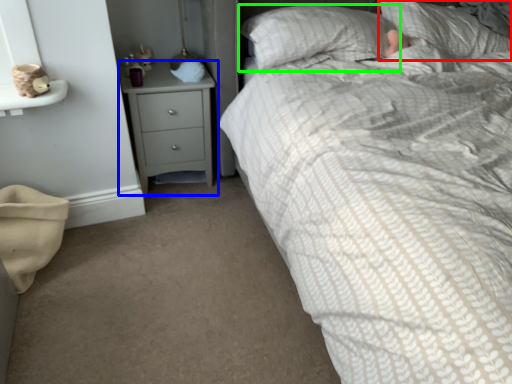
Question: Based on their relative distances, which object is farther from pillow (highlighted by a red box)? Choose from chest of drawers (highlighted by a blue box) and pillow (highlighted by a green box).

Choices:
 (A) chest of drawers
 (B) pillow

Answer: (A)